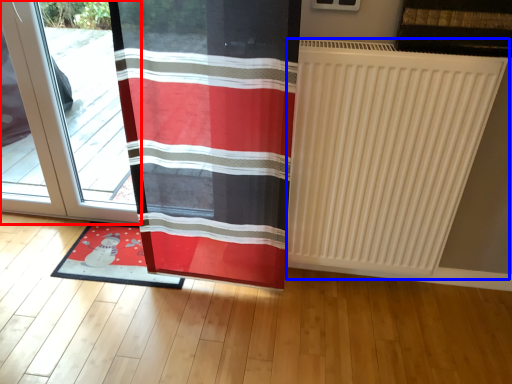
Question: Which object appears closest to the camera in this image, door (highlighted by a red box) or radiator (highlighted by a blue box)?

Choices:
 (A) door
 (B) radiator

Answer: (B)